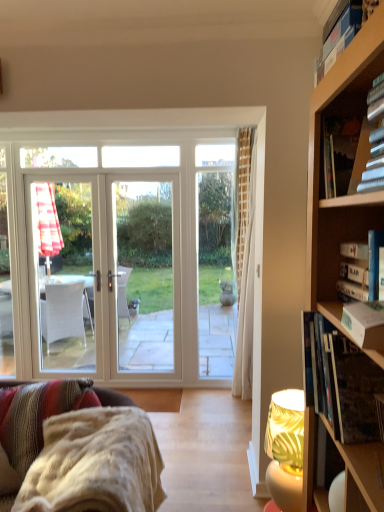
Question: From a real-world perspective, is white textured fabric couch at lower left above or below hardcover book at upper right, which ranks as the first book in top-to-bottom order?

Choices:
 (A) above
 (B) below

Answer: (B)

Question: In the image, is white textured fabric couch at lower left on the left side or the right side of hardcover book at upper right, arranged as the fifth book when ordered from the bottom?

Choices:
 (A) right
 (B) left

Answer: (B)

Question: Based on their relative distances, which object is farther from the hardcover book at right, marked as the third book in a top-to-bottom arrangement?

Choices:
 (A) white paper book at right, the 4th book in the top-to-bottom sequence
 (B) green leaf-patterned fabric lampshade at lower right
 (C) hardcover book at upper right, arranged as the fifth book when ordered from the bottom
 (D) hardcover book at upper right, which appears as the 4th book when ordered from the bottom
 (E) white textured fabric couch at lower left

Answer: (E)

Question: Estimate the real-world distances between objects in this image. Which object is farther from the hardcover book at right, placed as the 1th book when sorted from bottom to top?

Choices:
 (A) hardcover book at upper right, arranged as the fifth book when ordered from the bottom
 (B) white paper book at right, which ranks as the 2th book in bottom-to-top order
 (C) green leaf-patterned fabric lampshade at lower right
 (D) hardcover book at right, the 3th book in the bottom-to-top sequence
 (E) hardcover book at upper right, which appears as the 4th book when ordered from the bottom

Answer: (A)